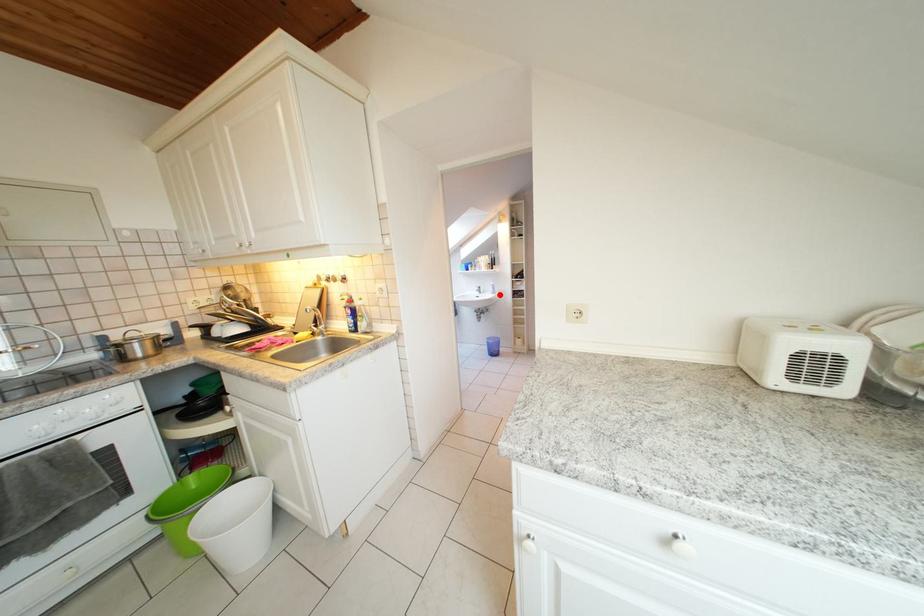
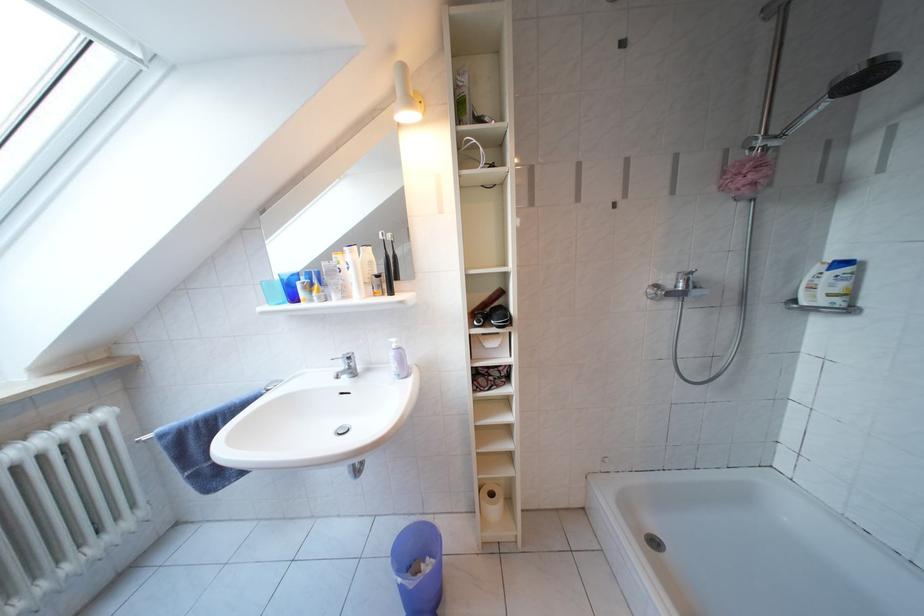
Locate, in the second image, the point that corresponds to the highlighted location in the first image.

(402, 371)